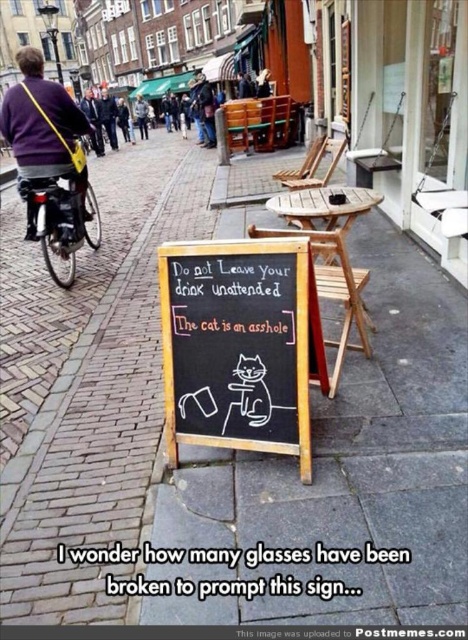
Who is more forward, (58, 100) or (66, 218)?

Point (58, 100)

Is point (85, 172) closer to camera compared to point (52, 264)?

That is True.

What do you see at coordinates (42, 131) in the screenshot? I see `purple fabric bag at upper left` at bounding box center [42, 131].

Where is `purple fabric bag at upper left`? Image resolution: width=468 pixels, height=640 pixels. purple fabric bag at upper left is located at coordinates (42, 131).

Is black matte bicycle at left to the right of dark blue sweater at upper left from the viewer's perspective?

Indeed, black matte bicycle at left is positioned on the right side of dark blue sweater at upper left.

Can you confirm if black matte bicycle at left is wider than dark blue sweater at upper left?

No, black matte bicycle at left is not wider than dark blue sweater at upper left.

What do you see at coordinates (63, 221) in the screenshot? I see `black matte bicycle at left` at bounding box center [63, 221].

Identify the location of black matte bicycle at left. (63, 221).

Is brown leather jacket at upper left to the left of dark blue sweater at upper left from the viewer's perspective?

Correct, you'll find brown leather jacket at upper left to the left of dark blue sweater at upper left.

Which is behind, point (114, 116) or point (144, 102)?

Point (144, 102)

Where is `brown leather jacket at upper left`? Image resolution: width=468 pixels, height=640 pixels. brown leather jacket at upper left is located at coordinates (109, 116).